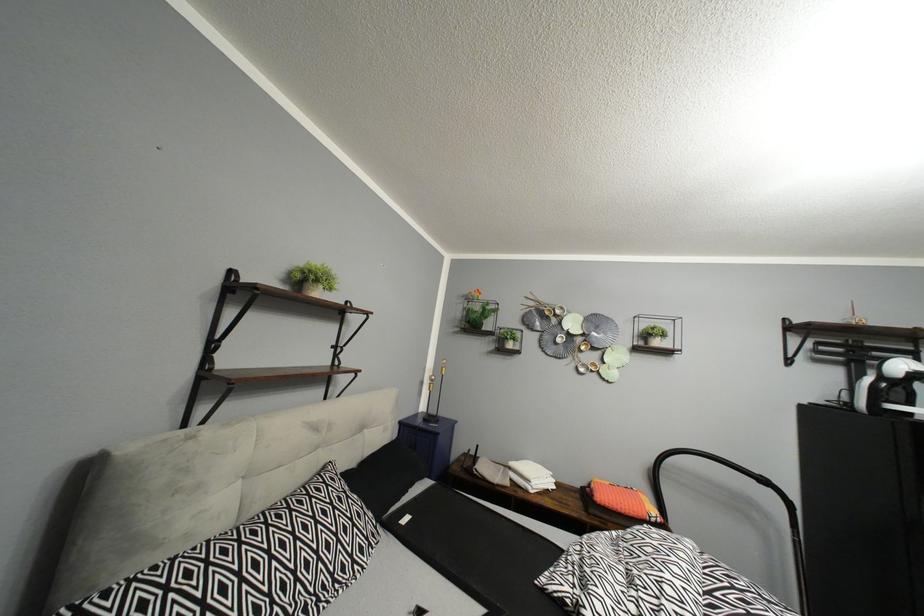
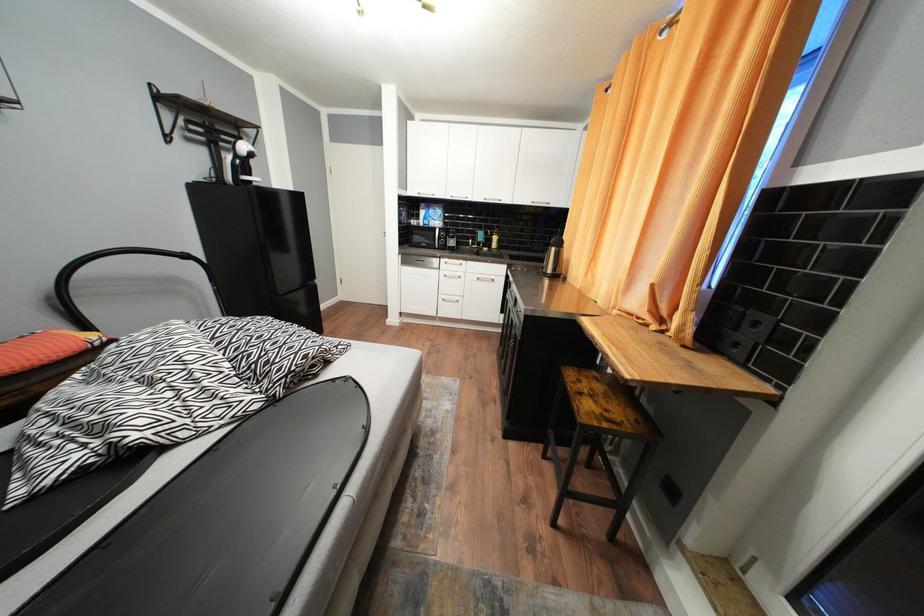
The images are taken continuously from a first-person perspective. In which direction is your viewpoint rotating?

The rotation direction of the camera is right-down.